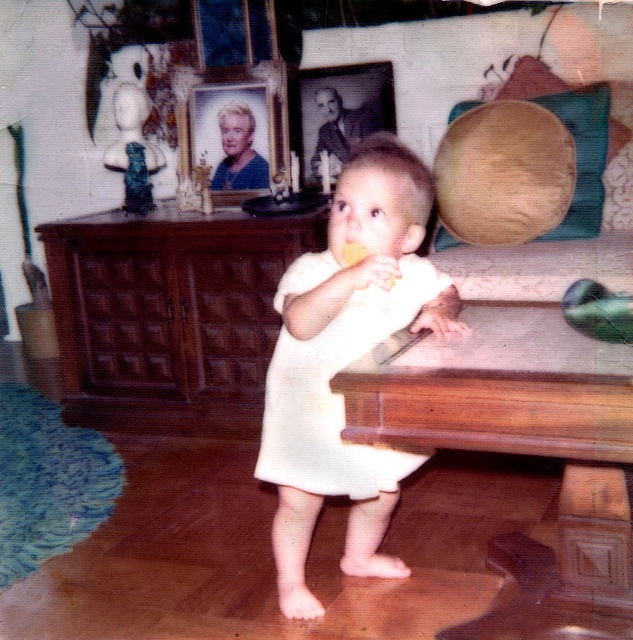
Consider the image. You are a professional photographer who needs to hang two frames on a wall. The wooden picture frame at upper center and the black glossy photo frame at upper center must be spaced exactly 12 inches apart. Based on the scene, will the current spacing between them meet your requirement?

The wooden picture frame at upper center and the black glossy photo frame at upper center are 11.92 inches apart from each other. Since 11.92 inches is slightly less than the required 12 inches, the current spacing does not meet the requirement.

Consider the image. You are a photographer trying to capture the child in the scene. To ensure the wooden picture frame at upper center is visible in the background while focusing on the white matte dress at center, where should you position the camera?

Position the camera so that the white matte dress at center is in the foreground and the wooden picture frame at upper center is in the background, as the white matte dress at center is located below the wooden picture frame at upper center.

You are a delivery person who needs to place a small package on the wooden table at center. According to the coordinates provided, where exactly should you place the package?

The wooden table at center should have the package placed at its coordinates point (522, 452).